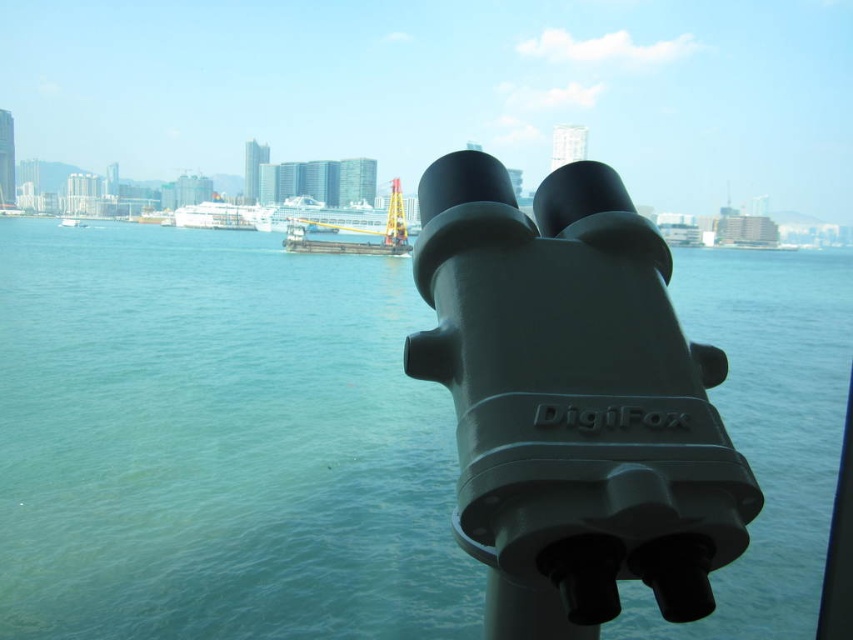
Question: Estimate the real-world distances between objects in this image. Which object is closer to the matte black telescope at center?

Choices:
 (A) yellow metallic crane at center
 (B) white glossy cruise ship at center

Answer: (A)

Question: Is yellow metallic crane at center positioned in front of white glossy cruise ship at center?

Choices:
 (A) no
 (B) yes

Answer: (B)

Question: Which object appears closest to the camera in this image?

Choices:
 (A) white glossy cruise ship at center
 (B) green matte water at center
 (C) matte black telescope at center

Answer: (C)

Question: In this image, where is matte black telescope at center located relative to white glossy cruise ship at center?

Choices:
 (A) above
 (B) below

Answer: (B)

Question: Based on their relative distances, which object is farther from the yellow metallic crane at center?

Choices:
 (A) matte black telescope at center
 (B) white glossy cruise ship at center
 (C) green matte water at center

Answer: (A)

Question: From the image, what is the correct spatial relationship of green matte water at center in relation to yellow metallic crane at center?

Choices:
 (A) right
 (B) left

Answer: (A)